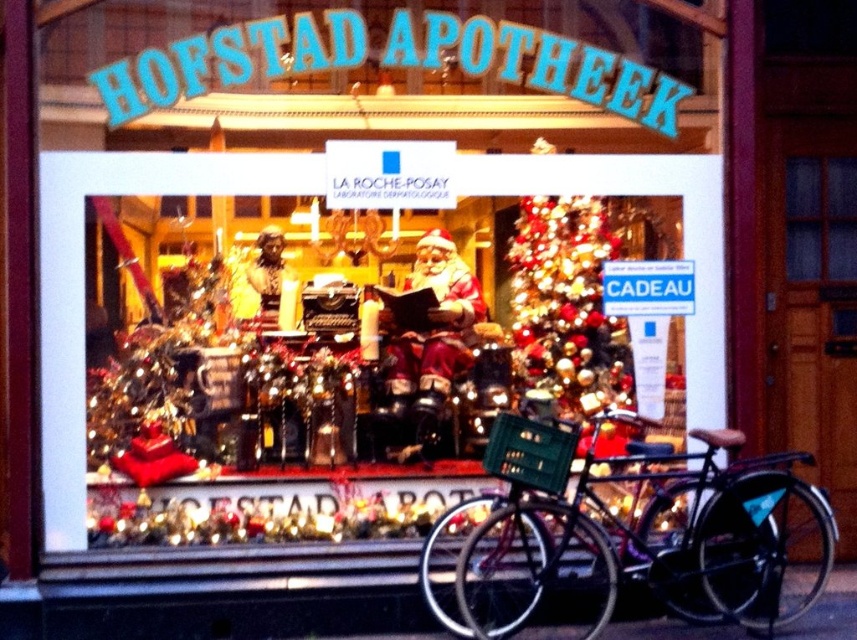
Question: Which of these objects is positioned closest to the shiny gold ornaments at center?

Choices:
 (A) clear glass window at upper right
 (B) matte black bicycle at lower right

Answer: (B)

Question: Does matte black bicycle at lower right appear on the left side of clear glass window at upper right?

Choices:
 (A) yes
 (B) no

Answer: (A)

Question: Among these objects, which one is nearest to the camera?

Choices:
 (A) matte black bicycle at lower right
 (B) clear glass window at upper right
 (C) black matte bicycle at lower right
 (D) shiny gold ornaments at center

Answer: (C)

Question: Observing the image, what is the correct spatial positioning of matte black bicycle at lower right in reference to shiny gold ornaments at center?

Choices:
 (A) below
 (B) above

Answer: (B)

Question: Considering the real-world distances, which object is farthest from the shiny gold ornaments at center?

Choices:
 (A) matte black bicycle at lower right
 (B) black matte bicycle at lower right

Answer: (B)

Question: Does matte black bicycle at lower right appear on the left side of shiny gold ornaments at center?

Choices:
 (A) yes
 (B) no

Answer: (A)